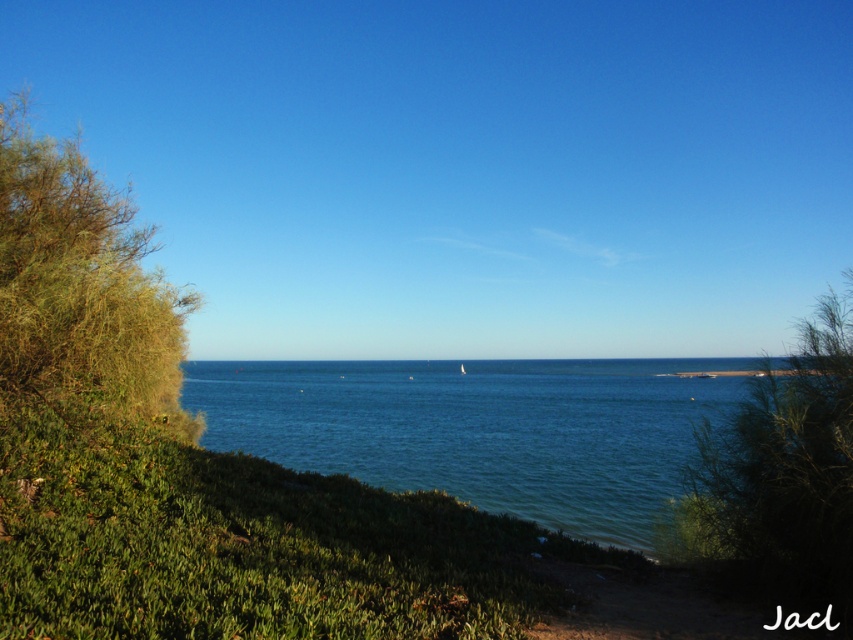
In the coastal scene, there are lush green vegetation in the foreground and a dirt path on the right. A small sailboat is present in the blue water at center. Where exactly is the point located at coordinates [483,429]?

The point at coordinates [483,429] is located in the blue water at center.

You are standing on the dirt path on the right side of the coastal scene. You want to walk to the point marked as point (x=483, y=429). Is that point located on the blue water at center?

Yes, the point (x=483, y=429) is on the blue water at center, so you can walk towards it but you will need to cross the blue water at center to reach it.

You are a hiker who just arrived at the coastal area. You see the blue water at center and the green leafy shrub at left. Which object is taller in this scene?

The green leafy shrub at left is taller than the blue water at center.